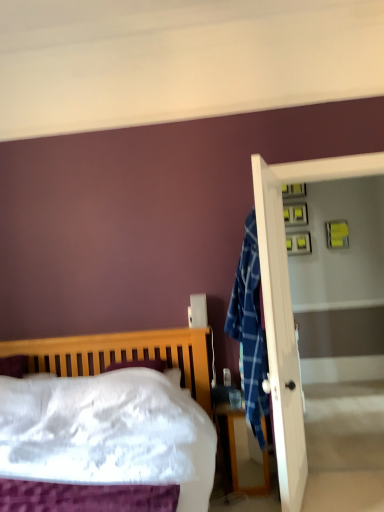
Question: Would you consider wooden bed at left to be distant from wooden nightstand at lower right?

Choices:
 (A) no
 (B) yes

Answer: (A)

Question: Is wooden bed at left shorter than wooden nightstand at lower right?

Choices:
 (A) yes
 (B) no

Answer: (B)

Question: Does wooden bed at left have a greater width compared to wooden nightstand at lower right?

Choices:
 (A) yes
 (B) no

Answer: (A)

Question: Considering the relative sizes of wooden bed at left and wooden nightstand at lower right in the image provided, is wooden bed at left bigger than wooden nightstand at lower right?

Choices:
 (A) yes
 (B) no

Answer: (A)

Question: Is wooden bed at left to the right of wooden nightstand at lower right from the viewer's perspective?

Choices:
 (A) no
 (B) yes

Answer: (A)

Question: Considering the relative positions of wooden bed at left and wooden nightstand at lower right in the image provided, is wooden bed at left behind wooden nightstand at lower right?

Choices:
 (A) yes
 (B) no

Answer: (B)

Question: Does white glossy screen door at right have a greater height compared to wooden bed at left?

Choices:
 (A) no
 (B) yes

Answer: (B)

Question: Does white glossy screen door at right lie behind wooden bed at left?

Choices:
 (A) no
 (B) yes

Answer: (B)

Question: From a real-world perspective, is white glossy screen door at right located beneath wooden bed at left?

Choices:
 (A) yes
 (B) no

Answer: (B)

Question: Is white glossy screen door at right touching wooden bed at left?

Choices:
 (A) yes
 (B) no

Answer: (B)

Question: From the image's perspective, is white glossy screen door at right above wooden bed at left?

Choices:
 (A) yes
 (B) no

Answer: (A)

Question: Considering the relative positions of white glossy screen door at right and wooden bed at left in the image provided, is white glossy screen door at right to the right of wooden bed at left from the viewer's perspective?

Choices:
 (A) no
 (B) yes

Answer: (B)

Question: Is wooden bed at left wider than white glossy screen door at right?

Choices:
 (A) no
 (B) yes

Answer: (B)